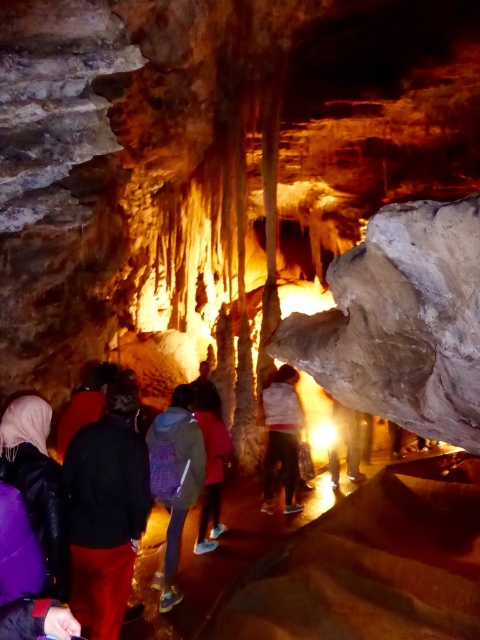
Question: Which of the following is the closest to the observer?

Choices:
 (A) purple fabric backpack at center
 (B) dark brown leather jacket at lower left
 (C) dark gray fabric backpack at center
 (D) purple leather jacket at lower left

Answer: (D)

Question: Considering the real-world distances, which object is closest to the purple leather jacket at lower left?

Choices:
 (A) smooth gray rock at center
 (B) white matte jacket at center
 (C) dark red leather jacket at lower left

Answer: (C)

Question: Is purple fabric backpack at center to the left of dark brown leather jacket at lower left from the viewer's perspective?

Choices:
 (A) yes
 (B) no

Answer: (B)

Question: Is dark red leather jacket at lower left to the right of dark brown leather jacket at lower left from the viewer's perspective?

Choices:
 (A) no
 (B) yes

Answer: (B)

Question: Does purple leather jacket at lower left have a larger size compared to dark brown leather jacket at lower left?

Choices:
 (A) yes
 (B) no

Answer: (B)

Question: Which object appears farthest from the camera in this image?

Choices:
 (A) purple fabric backpack at center
 (B) dark red leather jacket at lower left

Answer: (A)